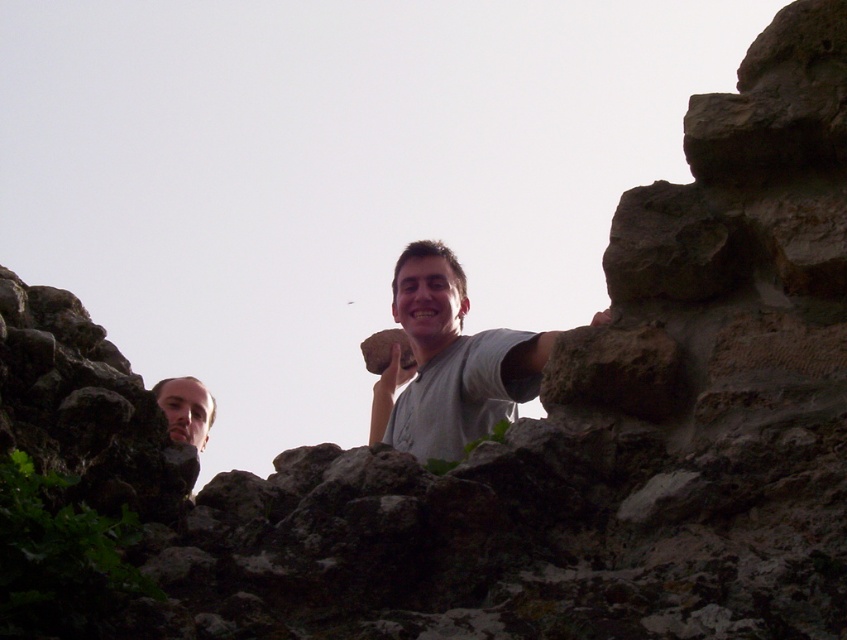
Describe the element at coordinates (84, 406) in the screenshot. I see `dark gray stone at lower left` at that location.

Can you confirm if dark gray stone at lower left is positioned below smooth skin face at lower left?

Incorrect, dark gray stone at lower left is not positioned below smooth skin face at lower left.

Between point (97, 502) and point (178, 406), which one is positioned behind?

The point (178, 406) is more distant.

You are a GUI agent. You are given a task and a screenshot of the screen. Output one action in this format:
    pyautogui.click(x=<x>, y=<y>)
    Task: Click on the dark gray stone at lower left
    
    Given the screenshot: What is the action you would take?
    pyautogui.click(x=84, y=406)

Does gray matte t-shirt at center have a lesser width compared to brown rough rock at center?

In fact, gray matte t-shirt at center might be wider than brown rough rock at center.

Based on the photo, does gray matte t-shirt at center have a greater width compared to brown rough rock at center?

Indeed, gray matte t-shirt at center has a greater width compared to brown rough rock at center.

Locate an element on the screen. This screenshot has width=847, height=640. gray matte t-shirt at center is located at coordinates tap(449, 364).

Which of these two, gray matte t-shirt at center or smooth skin face at lower left, stands taller?

Standing taller between the two is gray matte t-shirt at center.

Is point (392, 371) farther from viewer compared to point (201, 429)?

Yes, point (392, 371) is farther from viewer.

The height and width of the screenshot is (640, 847). Describe the element at coordinates (449, 364) in the screenshot. I see `gray matte t-shirt at center` at that location.

Identify the location of gray matte t-shirt at center. (449, 364).